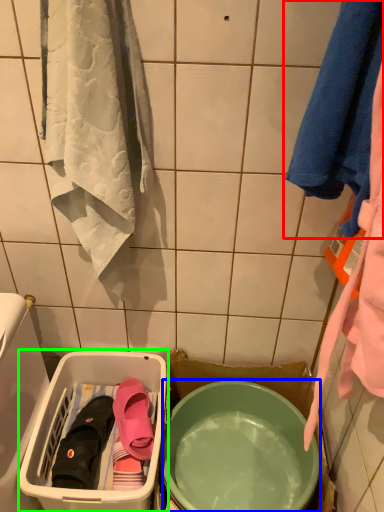
Question: Estimate the real-world distances between objects in this image. Which object is farther from towel (highlighted by a red box), mixing bowl (highlighted by a blue box) or laundry basket (highlighted by a green box)?

Choices:
 (A) mixing bowl
 (B) laundry basket

Answer: (B)